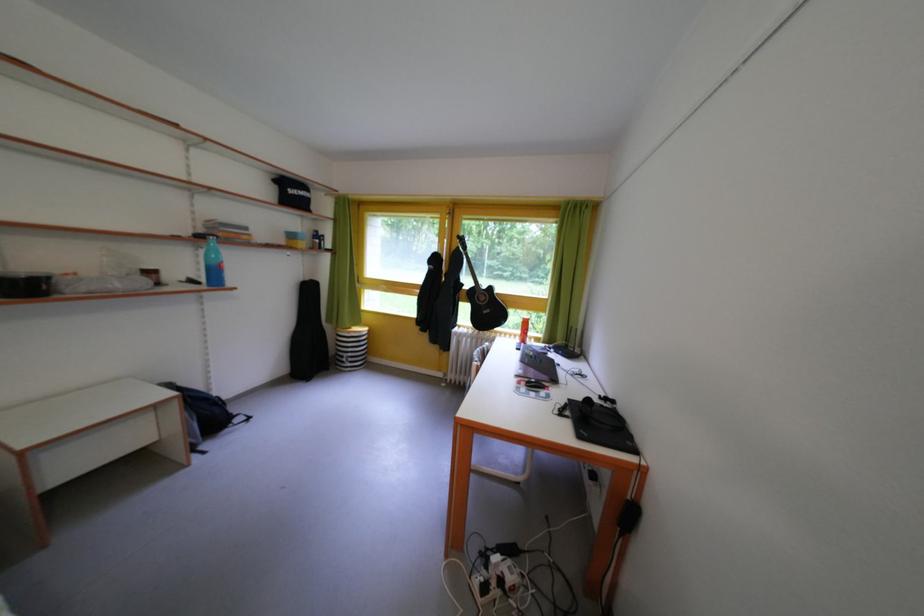
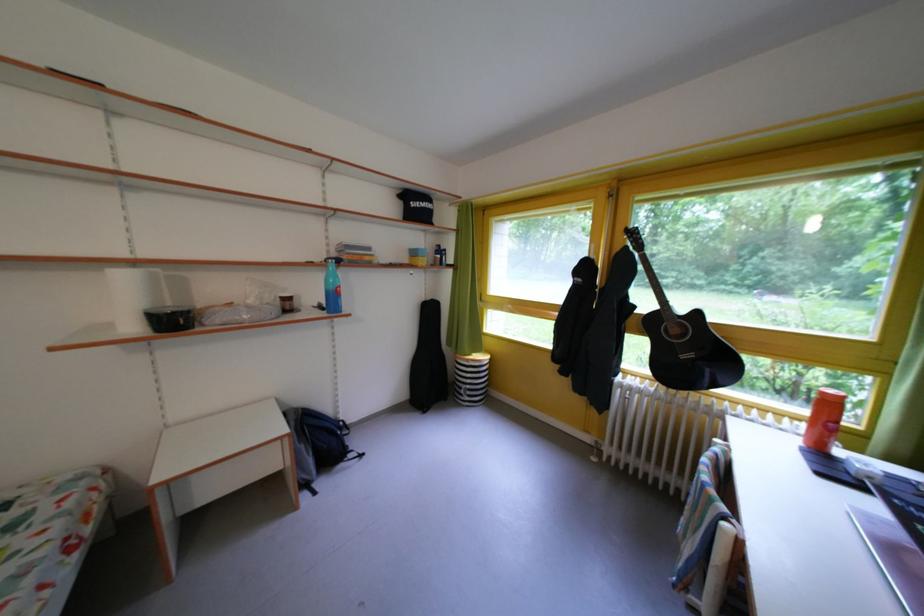
Where in the second image is the point corresponding to pixel 533 323 from the first image?

(833, 399)